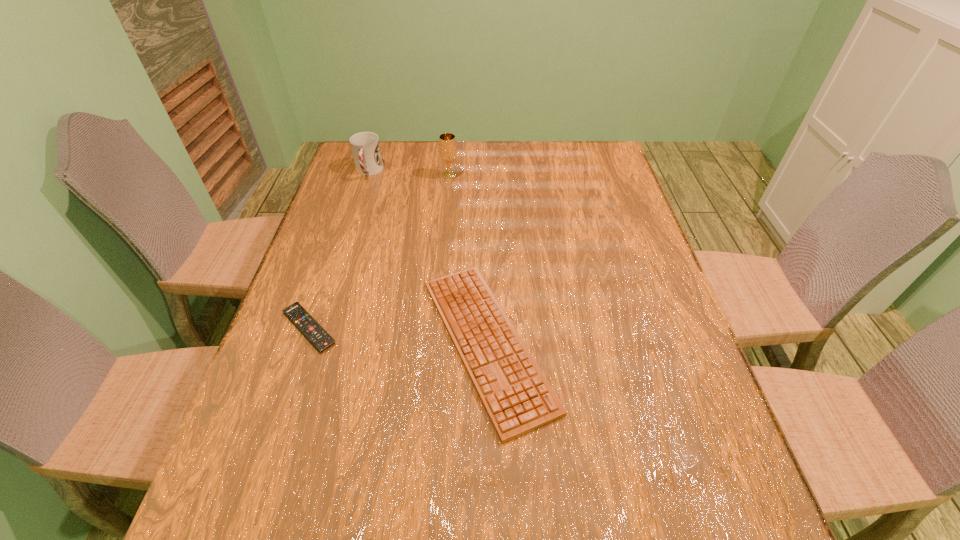
At what (x,y) coordinates should I click in order to perform the action: click on cup located at the left edge. Please return your answer as a coordinate pair (x, y). This screenshot has height=540, width=960. Looking at the image, I should click on (365, 146).

Locate an element on the screen. The width and height of the screenshot is (960, 540). remote control present at the left edge is located at coordinates (314, 332).

The height and width of the screenshot is (540, 960). I want to click on object at the far left corner, so click(x=365, y=146).

At what (x,y) coordinates should I click in order to perform the action: click on vacant space at the far edge of the desktop. Please return your answer as a coordinate pair (x, y). This screenshot has height=540, width=960. Looking at the image, I should click on (412, 162).

Identify the location of free space at the near edge. (374, 525).

In the image, there is a desktop. Where is `vacant space at the left edge`? vacant space at the left edge is located at coordinates [x=361, y=235].

Locate an element on the screen. vacant space at the right edge of the desktop is located at coordinates (638, 329).

Locate an element on the screen. The height and width of the screenshot is (540, 960). free space at the far left corner of the desktop is located at coordinates (338, 177).

Image resolution: width=960 pixels, height=540 pixels. In the image, there is a desktop. Find the location of `vacant space at the near right corner`. vacant space at the near right corner is located at coordinates (720, 526).

The height and width of the screenshot is (540, 960). Identify the location of vacant area that lies between the third tallest object and the chalice. (468, 259).